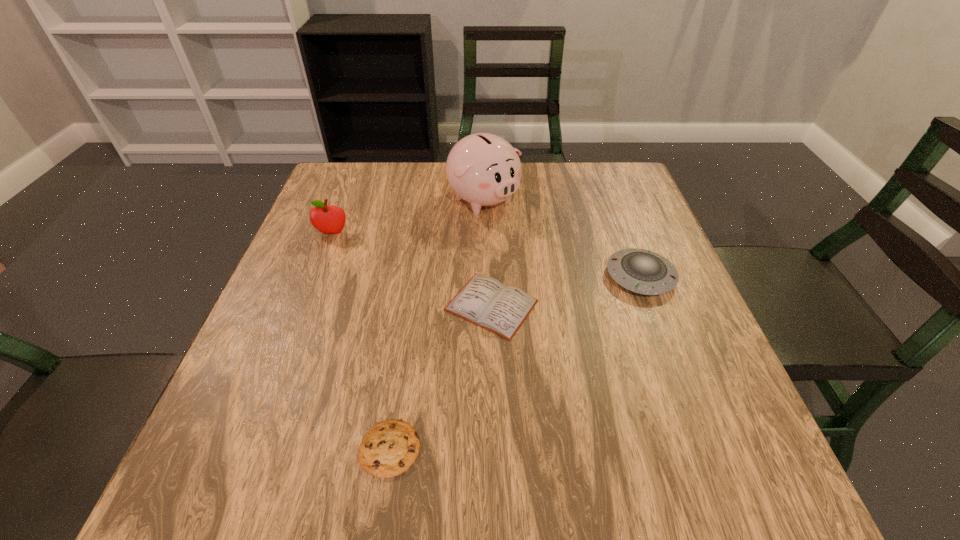
The width and height of the screenshot is (960, 540). Identify the location of the farthest object. (483, 169).

You are a GUI agent. You are given a task and a screenshot of the screen. Output one action in this format:
    pyautogui.click(x=<x>, y=<y>)
    Task: Click on the piggy bank
    
    Given the screenshot: What is the action you would take?
    pyautogui.click(x=483, y=169)

You are a GUI agent. You are given a task and a screenshot of the screen. Output one action in this format:
    pyautogui.click(x=<x>, y=<y>)
    Task: Click on the leftmost object
    The height and width of the screenshot is (540, 960).
    Given the screenshot: What is the action you would take?
    pyautogui.click(x=330, y=219)

At what (x,y) coordinates should I click in order to perform the action: click on the fourth nearest object. Please return your answer as a coordinate pair (x, y). This screenshot has width=960, height=540. Looking at the image, I should click on (330, 219).

At what (x,y) coordinates should I click in order to perform the action: click on the rightmost object. Please return your answer as a coordinate pair (x, y). This screenshot has height=540, width=960. Looking at the image, I should click on (x=641, y=271).

The image size is (960, 540). I want to click on the third shortest object, so click(641, 271).

Image resolution: width=960 pixels, height=540 pixels. I want to click on diary, so click(x=484, y=301).

At what (x,y) coordinates should I click in order to perform the action: click on cookie. Please return your answer as a coordinate pair (x, y). Image resolution: width=960 pixels, height=540 pixels. Looking at the image, I should click on (390, 448).

The width and height of the screenshot is (960, 540). Identify the location of the fourth object from right to left. (390, 448).

You are a GUI agent. You are given a task and a screenshot of the screen. Output one action in this format:
    pyautogui.click(x=<x>, y=<y>)
    Task: Click on the vacant space located 0.330m on the front of the piggy bank
    Image resolution: width=960 pixels, height=540 pixels.
    Given the screenshot: What is the action you would take?
    pyautogui.click(x=485, y=328)